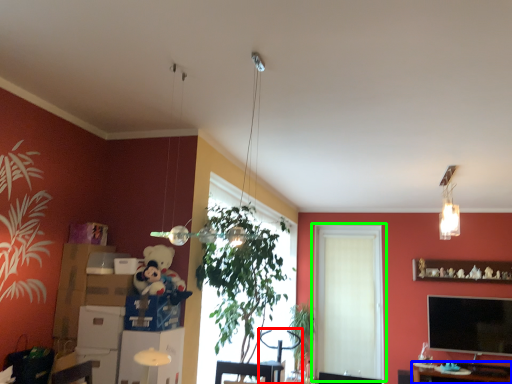
Question: Which object is positioned closest to swivel chair (highlighted by a red box)? Select from table (highlighted by a blue box) and window (highlighted by a green box).

Choices:
 (A) table
 (B) window

Answer: (B)